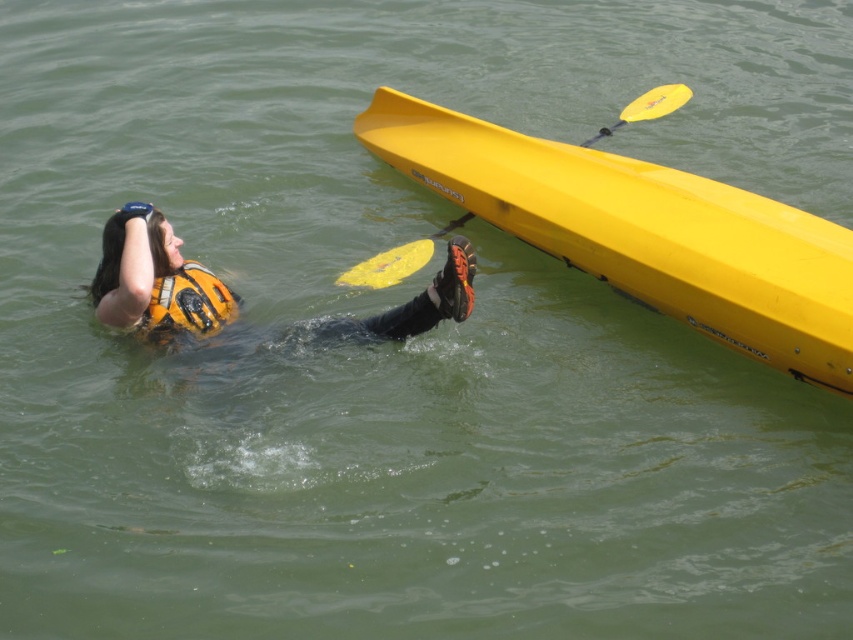
Question: Is yellow matte canoe at upper right positioned before orange life vest at upper left?

Choices:
 (A) yes
 (B) no

Answer: (A)

Question: Which of these objects is positioned closest to the yellow matte canoe at upper right?

Choices:
 (A) orange life vest at upper left
 (B) orange matte life jacket at lower left

Answer: (B)

Question: Which of the following is the closest to the observer?

Choices:
 (A) (820, 356)
 (B) (183, 280)

Answer: (A)

Question: Does orange matte life jacket at lower left have a lesser width compared to yellow matte paddle at upper right?

Choices:
 (A) yes
 (B) no

Answer: (A)

Question: Which object appears farthest from the camera in this image?

Choices:
 (A) orange matte life jacket at lower left
 (B) orange life vest at upper left
 (C) yellow matte canoe at upper right
 (D) yellow matte paddle at upper right

Answer: (D)

Question: Can you confirm if orange matte life jacket at lower left is bigger than yellow matte paddle at upper right?

Choices:
 (A) yes
 (B) no

Answer: (B)